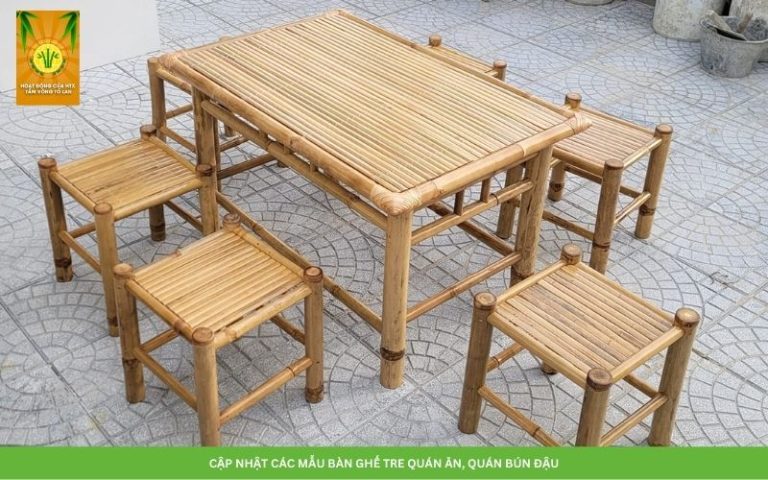
Identify the location of light brown stools. This screenshot has width=768, height=480. (193, 271), (124, 172), (518, 300), (594, 154).